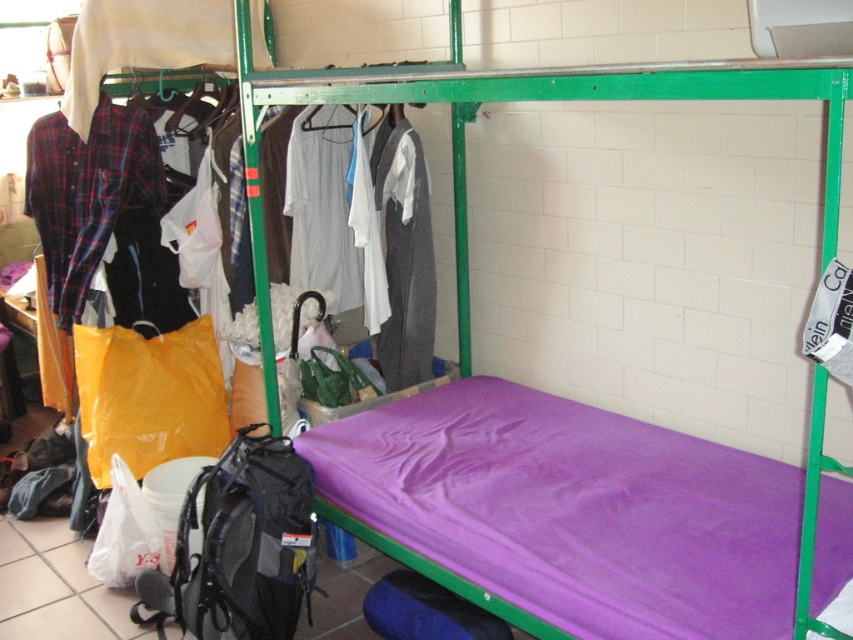
Between purple fabric mattress at lower center and plaid cotton shirt at left, which one appears on the right side from the viewer's perspective?

From the viewer's perspective, purple fabric mattress at lower center appears more on the right side.

Can you confirm if purple fabric mattress at lower center is positioned to the right of plaid cotton shirt at left?

Correct, you'll find purple fabric mattress at lower center to the right of plaid cotton shirt at left.

At what (x,y) coordinates should I click in order to perform the action: click on purple fabric mattress at lower center. Please return your answer as a coordinate pair (x, y). Looking at the image, I should click on (573, 509).

Between dark gray wool sweater at center and white striped shirt at center, which one has less height?

white striped shirt at center is shorter.

Who is more forward, (392, 266) or (318, 212)?

Point (392, 266)

In order to click on dark gray wool sweater at center in this screenshot , I will do `click(404, 253)`.

Between plaid cotton shirt at left and white striped shirt at center, which one has more height?

Standing taller between the two is plaid cotton shirt at left.

Is point (67, 232) more distant than point (361, 298)?

That is False.

This screenshot has height=640, width=853. What do you see at coordinates (86, 193) in the screenshot? I see `plaid cotton shirt at left` at bounding box center [86, 193].

This screenshot has height=640, width=853. I want to click on plaid cotton shirt at left, so (86, 193).